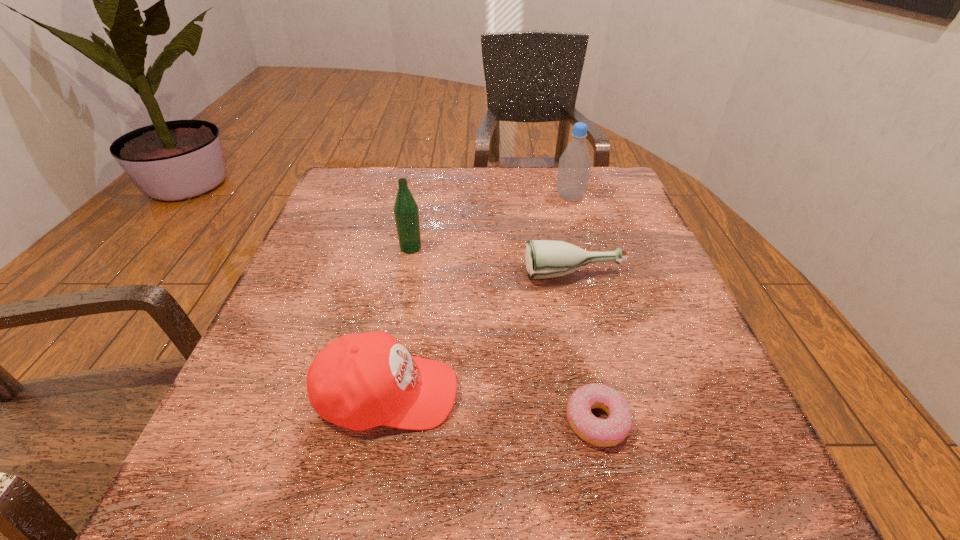
Find the location of a particular element. vacant space that satisfies the following two spatial constraints: 1. on the front panel of the third tallest object; 2. on the back side of the shortest object is located at coordinates (382, 421).